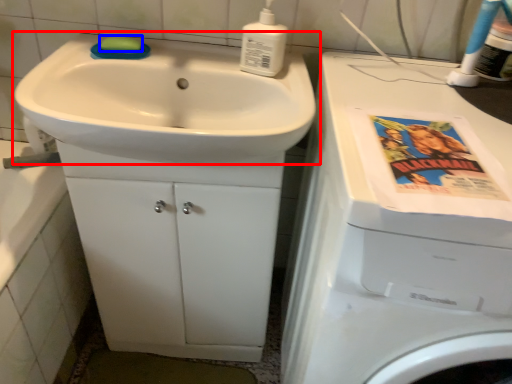
Question: Which point is further to the camera, sink (highlighted by a red box) or soap (highlighted by a blue box)?

Choices:
 (A) sink
 (B) soap

Answer: (B)